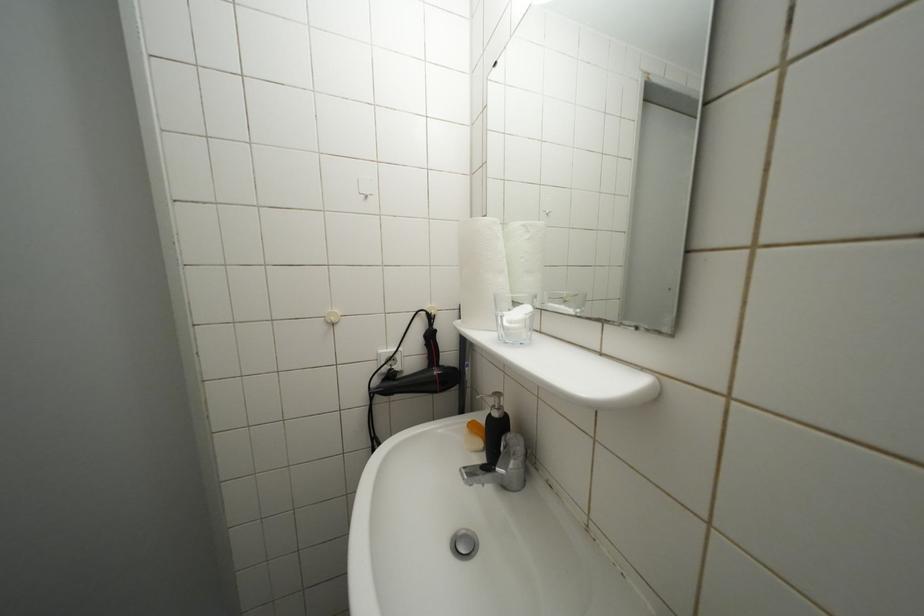
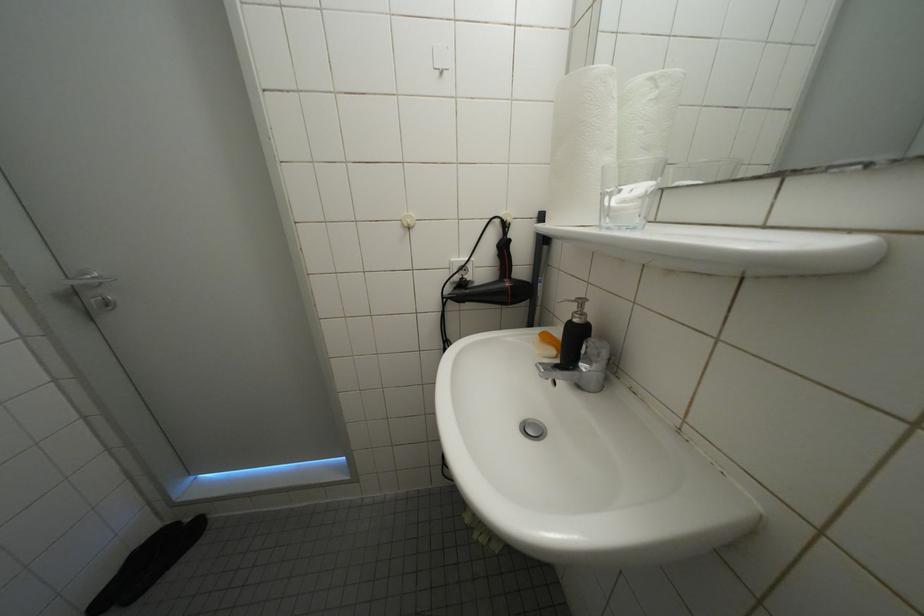
Question: In a continuous first-person perspective shot, in which direction is the camera moving?

Choices:
 (A) Left
 (B) Right
 (C) Forward
 (D) Backward

Answer: (A)